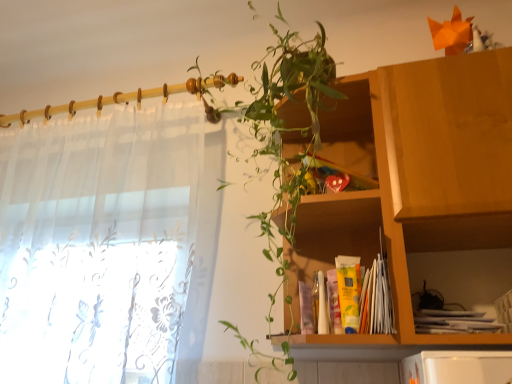
Identify the location of green leafy plant at upper center. The height and width of the screenshot is (384, 512). (284, 128).

Where is `wooden cabinet at center`? The width and height of the screenshot is (512, 384). wooden cabinet at center is located at coordinates [343, 165].

The image size is (512, 384). I want to click on sheer white curtain at left, so click(108, 246).

Describe the element at coordinates (414, 176) in the screenshot. I see `wooden cabinet at upper right` at that location.

What are the coordinates of `green leafy plant at upper center` in the screenshot? It's located at (284, 128).

Is sheer white curtain at left positioned in front of wooden cabinet at center?

That is True.

Does point (42, 332) appear closer or farther from the camera than point (286, 143)?

Point (42, 332).

Can you see sheer white curtain at left touching wooden cabinet at center?

There is a gap between sheer white curtain at left and wooden cabinet at center.

At what (x,y) coordinates should I click in order to perform the action: click on curtain that is below the wooden cabinet at center (from the image's perspective). Please return your answer as a coordinate pair (x, y). Looking at the image, I should click on (108, 246).

You are a GUI agent. You are given a task and a screenshot of the screen. Output one action in this format:
    pyautogui.click(x=<x>, y=<y>)
    Task: Click on the houseplant above the wooden cabinet at center (from the image's perspective)
    
    Given the screenshot: What is the action you would take?
    pyautogui.click(x=284, y=128)

Does green leafy plant at upper center have a smaller size compared to wooden cabinet at center?

No, green leafy plant at upper center is not smaller than wooden cabinet at center.

In the image, is green leafy plant at upper center positioned in front of or behind wooden cabinet at center?

In the image, green leafy plant at upper center appears in front of wooden cabinet at center.

Is wooden cabinet at center at the back of green leafy plant at upper center?

No.

Would you consider wooden cabinet at center to be distant from sheer white curtain at left?

wooden cabinet at center is near sheer white curtain at left, not far away.

Is wooden cabinet at center thinner than sheer white curtain at left?

Indeed, wooden cabinet at center has a lesser width compared to sheer white curtain at left.

How different are the orientations of wooden cabinet at center and sheer white curtain at left in degrees?

0.00188 degrees separate the facing orientations of wooden cabinet at center and sheer white curtain at left.

Is wooden cabinet at center spatially inside sheer white curtain at left, or outside of it?

wooden cabinet at center is spatially situated outside sheer white curtain at left.

Is wooden cabinet at center facing towards wooden cabinet at upper right?

Yes, wooden cabinet at center faces towards wooden cabinet at upper right.

Considering the relative sizes of wooden cabinet at center and wooden cabinet at upper right in the image provided, is wooden cabinet at center smaller than wooden cabinet at upper right?

Yes.

Consider the image. Considering the positions of objects wooden cabinet at center and wooden cabinet at upper right in the image provided, who is more to the left, wooden cabinet at center or wooden cabinet at upper right?

Positioned to the left is wooden cabinet at center.

Can you confirm if wooden cabinet at center is shorter than wooden cabinet at upper right?

Correct, wooden cabinet at center is not as tall as wooden cabinet at upper right.

Consider the image. Could you tell me if wooden cabinet at upper right is facing sheer white curtain at left?

No.

Is wooden cabinet at upper right inside the boundaries of sheer white curtain at left, or outside?

wooden cabinet at upper right is not inside sheer white curtain at left, it's outside.

You are a GUI agent. You are given a task and a screenshot of the screen. Output one action in this format:
    pyautogui.click(x=<x>, y=<y>)
    Task: Click on the curtain above the wooden cabinet at upper right (from a real-world perspective)
    
    Given the screenshot: What is the action you would take?
    pyautogui.click(x=108, y=246)

Is wooden cabinet at upper right far away from sheer white curtain at left?

wooden cabinet at upper right is near sheer white curtain at left, not far away.

Is sheer white curtain at left spatially inside wooden cabinet at upper right, or outside of it?

sheer white curtain at left is not enclosed by wooden cabinet at upper right.

Consider the image. From a real-world perspective, which is physically above, sheer white curtain at left or wooden cabinet at upper right?

sheer white curtain at left, from a real-world perspective.

Which is farther from the camera, (195, 215) or (394, 340)?

Positioned behind is point (195, 215).

Considering the relative positions of sheer white curtain at left and wooden cabinet at upper right in the image provided, is sheer white curtain at left to the left or to the right of wooden cabinet at upper right?

Clearly, sheer white curtain at left is on the left of wooden cabinet at upper right in the image.

Would you say green leafy plant at upper center is a long distance from sheer white curtain at left?

No, green leafy plant at upper center is in close proximity to sheer white curtain at left.

Does green leafy plant at upper center turn towards sheer white curtain at left?

No, green leafy plant at upper center is not facing towards sheer white curtain at left.

Considering the sizes of objects green leafy plant at upper center and sheer white curtain at left in the image provided, who is thinner, green leafy plant at upper center or sheer white curtain at left?

Thinner between the two is sheer white curtain at left.

From a real-world perspective, which object rests below the other?

From a 3D spatial view, sheer white curtain at left is below.

You are a GUI agent. You are given a task and a screenshot of the screen. Output one action in this format:
    pyautogui.click(x=<x>, y=<y>)
    Task: Click on the curtain below the wooden cabinet at center (from a real-world perspective)
    This screenshot has width=512, height=384.
    Given the screenshot: What is the action you would take?
    pyautogui.click(x=108, y=246)

Where is `houseplant that is in front of the wooden cabinet at center`? houseplant that is in front of the wooden cabinet at center is located at coordinates (284, 128).

Estimate the real-world distances between objects in this image. Which object is further from wooden cabinet at center, wooden cabinet at upper right or green leafy plant at upper center?

green leafy plant at upper center lies further to wooden cabinet at center than the other object.

Which object lies further to the anchor point green leafy plant at upper center, wooden cabinet at upper right or wooden cabinet at center?

Among the two, wooden cabinet at center is located further to green leafy plant at upper center.

Considering their positions, is sheer white curtain at left positioned closer to wooden cabinet at center than wooden cabinet at upper right?

Result: The object closer to wooden cabinet at center is wooden cabinet at upper right.

Which object lies further to the anchor point sheer white curtain at left, wooden cabinet at upper right or wooden cabinet at center?

The object further to sheer white curtain at left is wooden cabinet at center.

Looking at the image, which one is located further to sheer white curtain at left, wooden cabinet at center or green leafy plant at upper center?

wooden cabinet at center.

Estimate the real-world distances between objects in this image. Which object is closer to sheer white curtain at left, wooden cabinet at center or wooden cabinet at upper right?

wooden cabinet at upper right is positioned closer to the anchor sheer white curtain at left.

When comparing their distances from wooden cabinet at center, does sheer white curtain at left or green leafy plant at upper center seem closer?

green leafy plant at upper center is positioned closer to the anchor wooden cabinet at center.

Estimate the real-world distances between objects in this image. Which object is further from sheer white curtain at left, green leafy plant at upper center or wooden cabinet at center?

Result: wooden cabinet at center is positioned further to the anchor sheer white curtain at left.

The height and width of the screenshot is (384, 512). I want to click on cabinet between green leafy plant at upper center and wooden cabinet at upper right, so click(343, 165).

Find the location of a particular element. The width and height of the screenshot is (512, 384). houseplant between sheer white curtain at left and wooden cabinet at upper right in the horizontal direction is located at coordinates (284, 128).

Where is `houseplant between sheer white curtain at left and wooden cabinet at center in the horizontal direction`? houseplant between sheer white curtain at left and wooden cabinet at center in the horizontal direction is located at coordinates (284, 128).

I want to click on cabinet situated between sheer white curtain at left and wooden cabinet at upper right from left to right, so click(343, 165).